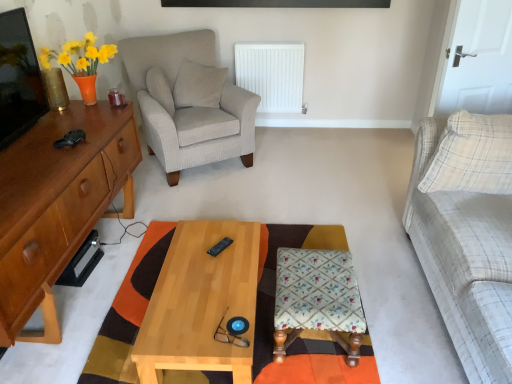
Where is `vacant space to the right of light gray textured armchair at center`? The height and width of the screenshot is (384, 512). vacant space to the right of light gray textured armchair at center is located at coordinates (296, 162).